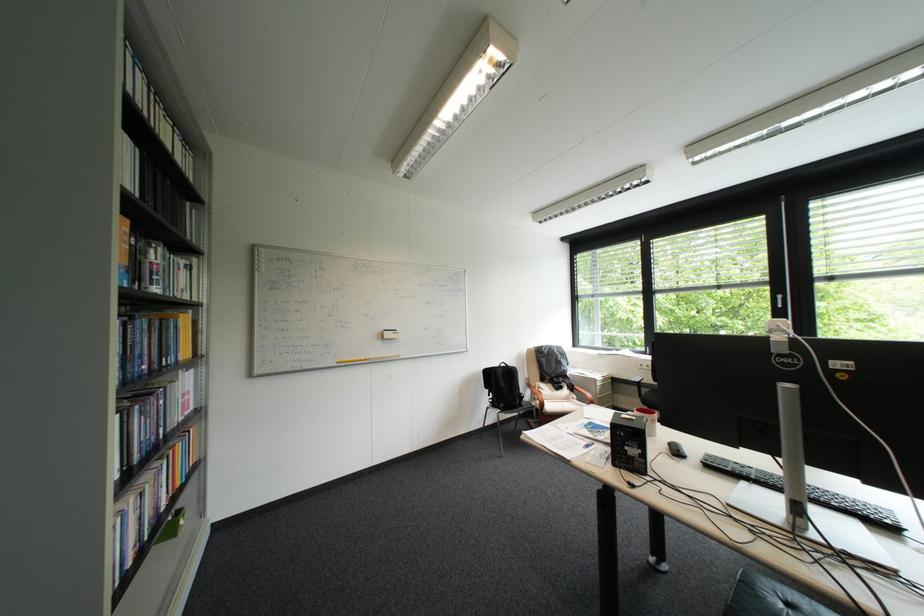
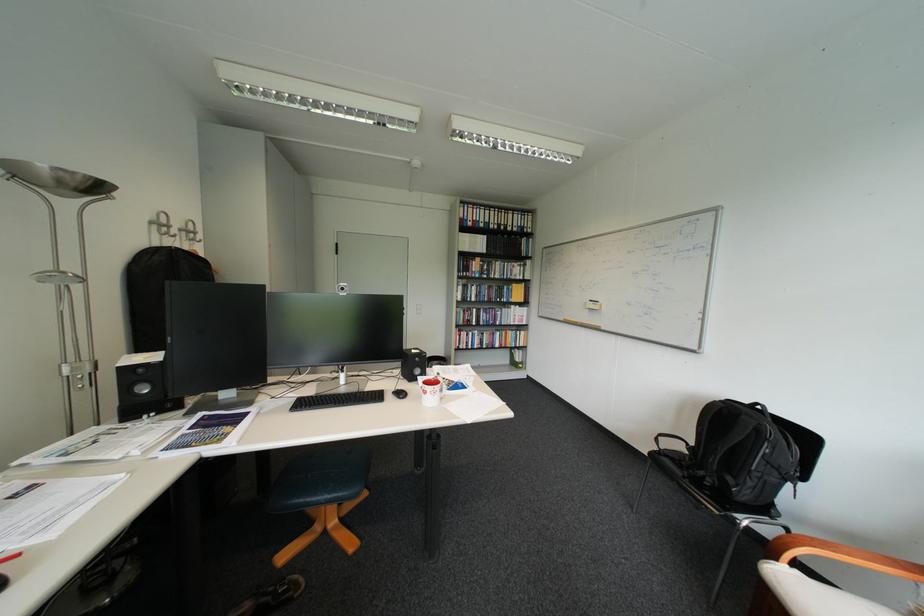
The point at (556, 406) is marked in the first image. Where is the corresponding point in the second image?

(788, 560)